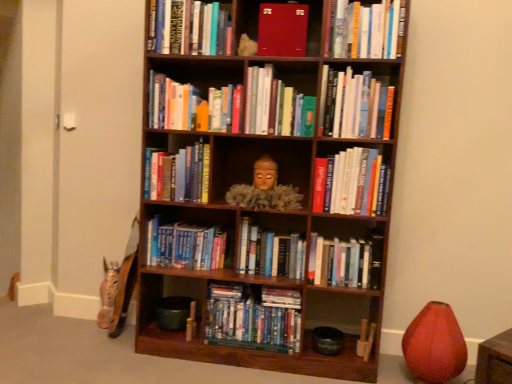
Question: From a real-world perspective, is matte red vase at lower right located higher than hardcover books at center, the 3th book in the bottom-to-top sequence?

Choices:
 (A) yes
 (B) no

Answer: (B)

Question: Considering the relative positions of matte red vase at lower right and hardcover books at center, the 3th book in the bottom-to-top sequence, in the image provided, is matte red vase at lower right in front of hardcover books at center, the 3th book in the bottom-to-top sequence,?

Choices:
 (A) yes
 (B) no

Answer: (A)

Question: Can you confirm if matte red vase at lower right is taller than hardcover books at center, which ranks as the 10th book in top-to-bottom order?

Choices:
 (A) no
 (B) yes

Answer: (B)

Question: Is matte red vase at lower right not within hardcover books at center, the 3th book in the bottom-to-top sequence?

Choices:
 (A) no
 (B) yes

Answer: (B)

Question: Can you confirm if matte red vase at lower right is shorter than hardcover books at center, which ranks as the 10th book in top-to-bottom order?

Choices:
 (A) no
 (B) yes

Answer: (A)

Question: Is matte red vase at lower right oriented away from hardcover books at center, the 3th book in the bottom-to-top sequence?

Choices:
 (A) no
 (B) yes

Answer: (A)

Question: From the image's perspective, is matte gold statue at center over blue hardcover books at center, the ninth book viewed from the top?

Choices:
 (A) no
 (B) yes

Answer: (B)

Question: From a real-world perspective, is matte gold statue at center on blue hardcover books at center, the 4th book ordered from the bottom?

Choices:
 (A) no
 (B) yes

Answer: (B)

Question: Is matte gold statue at center closer to the viewer compared to blue hardcover books at center, the ninth book viewed from the top?

Choices:
 (A) no
 (B) yes

Answer: (B)

Question: Does matte gold statue at center appear on the left side of blue hardcover books at center, the ninth book viewed from the top?

Choices:
 (A) no
 (B) yes

Answer: (A)

Question: Does matte gold statue at center have a greater height compared to blue hardcover books at center, the 4th book ordered from the bottom?

Choices:
 (A) no
 (B) yes

Answer: (A)

Question: Can blue hardcover books at center, the 4th book ordered from the bottom, be found inside matte gold statue at center?

Choices:
 (A) yes
 (B) no

Answer: (B)

Question: Could hardcover book at upper center, the 9th book in the bottom-to-top sequence, be considered to be inside matte red book at upper center, the second book from the top?

Choices:
 (A) yes
 (B) no

Answer: (B)